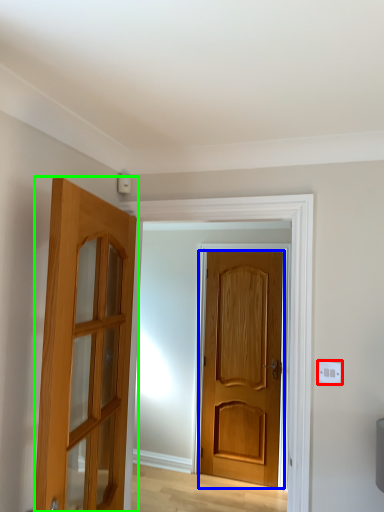
Question: Which object is the closest to the electric outlet (highlighted by a red box)? Choose among these: door (highlighted by a blue box) or door (highlighted by a green box).

Choices:
 (A) door
 (B) door

Answer: (B)